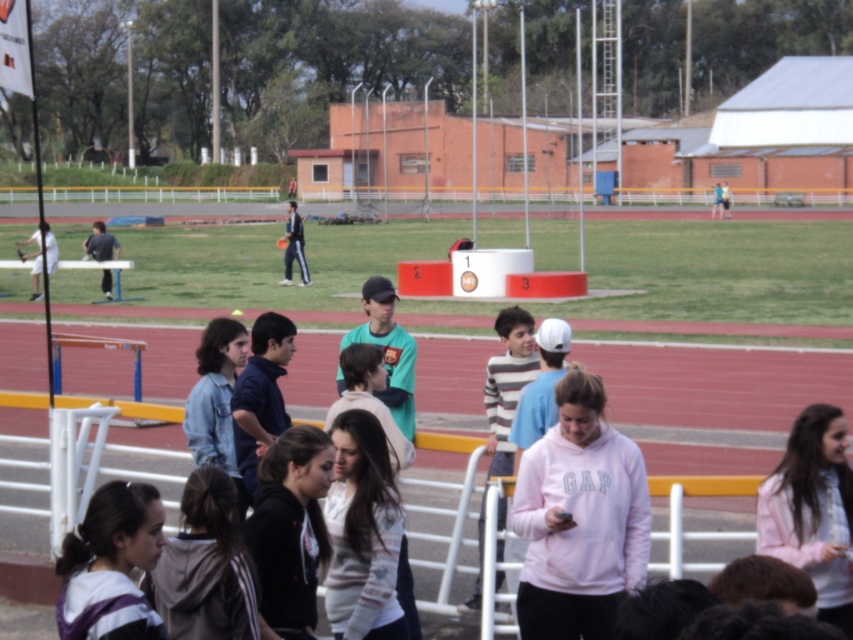
You are standing at the center of the sports field and want to move towards the point that is closer to you. Which point should you walk towards, point (791, 529) or point (41, 243)?

Point (791, 529) is closer to the viewer than point (41, 243), so you should walk towards point (791, 529).

You are a photographer at the sports field and want to capture both the pink fleece sweatshirt at center and the white matte tennis racket at left in the same frame. Based on their positions, which object should you focus on first to ensure both are in the frame?

You should focus on the pink fleece sweatshirt at center first because it is positioned to the right of the white matte tennis racket at left, so by centering the pink fleece sweatshirt, the white matte tennis racket will naturally be included in the frame to its left.

You are a photographer standing at the center of the field. You want to take a photo that includes both the pink fleece sweatshirt at center and the white matte tennis racket at left. Given that your camera has a maximum zoom range of 20 meters, can you capture both objects in the same frame without moving?

The pink fleece sweatshirt at center and the white matte tennis racket at left are 23.31 meters apart from each other. Since the distance exceeds the camera maximum zoom range of 20 meters, you cannot capture both objects in the same frame without moving.